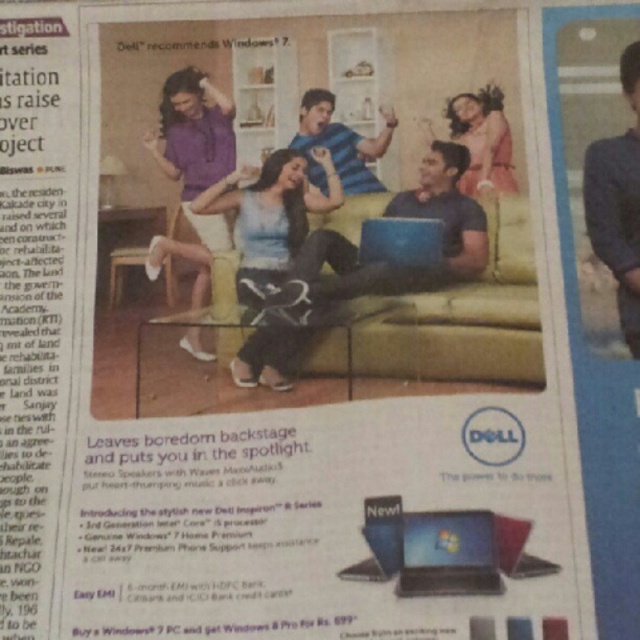
Question: Does blue matte laptop at center appear on the right side of matte black laptop at center?

Choices:
 (A) no
 (B) yes

Answer: (A)

Question: Among these objects, which one is nearest to the camera?

Choices:
 (A) black glossy laptop at lower center
 (B) blue shirt at right

Answer: (A)

Question: Which point is farther to the camera?

Choices:
 (A) pink fabric dress at upper right
 (B) matte black laptop at lower right
 (C) blue striped shirt at center
 (D) black glossy laptop at lower center

Answer: (C)

Question: Considering the relative positions of matte blue jeans at center and black glossy laptop at lower center in the image provided, where is matte blue jeans at center located with respect to black glossy laptop at lower center?

Choices:
 (A) left
 (B) right

Answer: (A)

Question: From the image, what is the correct spatial relationship of blue matte laptop at center in relation to black glossy laptop at lower center?

Choices:
 (A) left
 (B) right

Answer: (A)

Question: Which object is farther from the camera taking this photo?

Choices:
 (A) pink fabric dress at upper right
 (B) matte blue jeans at center
 (C) blue striped shirt at center

Answer: (C)